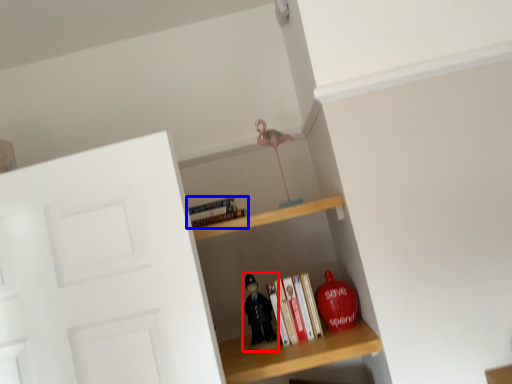
Question: Among these objects, which one is farthest to the camera, toy (highlighted by a red box) or book (highlighted by a blue box)?

Choices:
 (A) toy
 (B) book

Answer: (A)